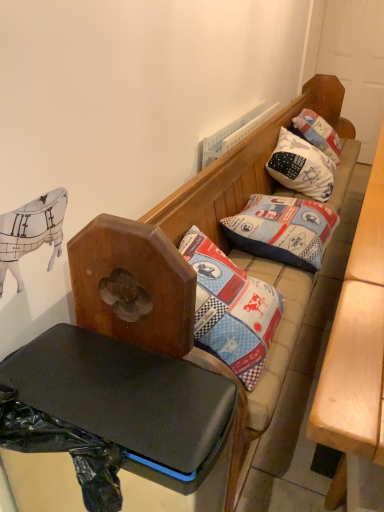
Question: From their relative heights in the image, would you say black plastic table at lower left, the first table positioned from the left, is taller or shorter than patchwork fabric pillow at center, arranged as the 2th pillow when viewed from the back?

Choices:
 (A) tall
 (B) short

Answer: (A)

Question: From a real-world perspective, is black plastic table at lower left, which appears as the second table when viewed from the right, positioned above or below patchwork fabric pillow at center, arranged as the 2th pillow when viewed from the back?

Choices:
 (A) below
 (B) above

Answer: (A)

Question: Which of these objects is positioned farthest from the white cotton pillow at upper right, acting as the second pillow starting from the front?

Choices:
 (A) light brown wooden table at right, the 1th table from the right
 (B) black plastic table at lower left, which appears as the second table when viewed from the right
 (C) patchwork fabric pillow at center, positioned as the 1th pillow in front-to-back order

Answer: (B)

Question: Which object is positioned closest to the black plastic table at lower left, which appears as the second table when viewed from the right?

Choices:
 (A) patchwork fabric pillow at center, arranged as the 2th pillow when viewed from the back
 (B) light brown wooden table at right, the 1th table from the right
 (C) white cotton pillow at upper right, marked as the 1th pillow in a back-to-front arrangement

Answer: (B)